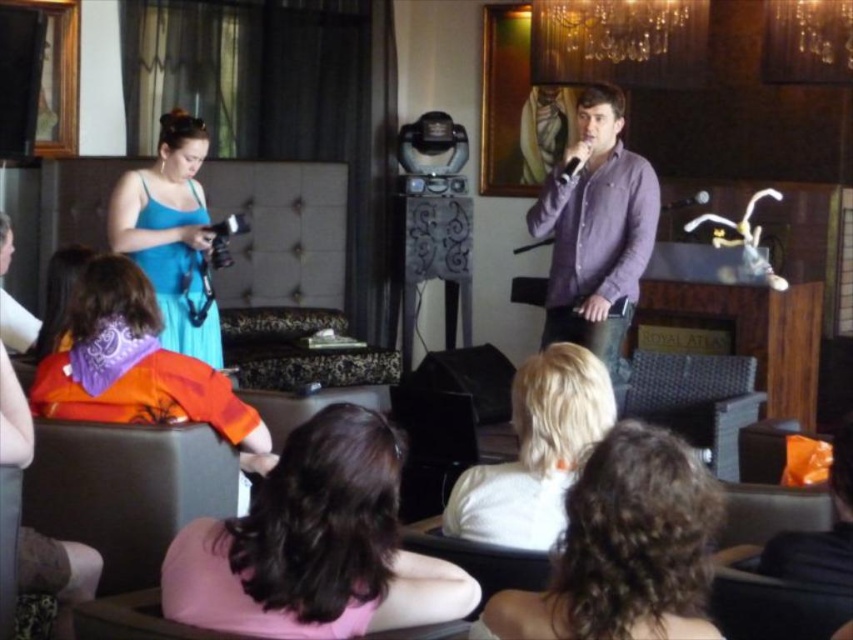
Question: Which point is farther to the camera?

Choices:
 (A) (641, 216)
 (B) (677, 451)

Answer: (A)

Question: Does dark brown hair at center lie in front of purple cotton shirt at upper right?

Choices:
 (A) no
 (B) yes

Answer: (B)

Question: Which of the following is the farthest from the observer?

Choices:
 (A) (445, 369)
 (B) (556, 269)
 (C) (532, 440)
 (D) (190, 198)

Answer: (A)

Question: Which point is closer to the camera?

Choices:
 (A) purple bandana at center
 (B) matte black speaker at center
 (C) white matte hair at center
 (D) matte blue dress at left

Answer: (C)

Question: Is dark brown curly hair at lower center to the right of white matte hair at center from the viewer's perspective?

Choices:
 (A) yes
 (B) no

Answer: (A)

Question: Is purple cotton shirt at upper right positioned in front of matte blue dress at left?

Choices:
 (A) no
 (B) yes

Answer: (B)